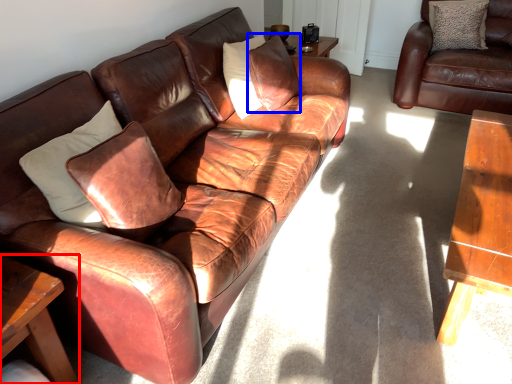
Question: Which of the following is the farthest to the observer, table (highlighted by a red box) or pillow (highlighted by a blue box)?

Choices:
 (A) table
 (B) pillow

Answer: (B)